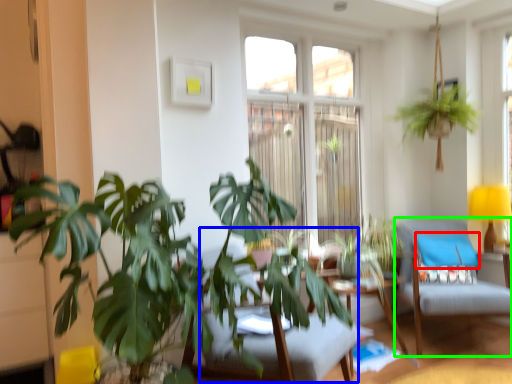
Question: Which object is positioned farthest from pillow (highlighted by a red box)? Select from swivel chair (highlighted by a blue box) and swivel chair (highlighted by a green box).

Choices:
 (A) swivel chair
 (B) swivel chair

Answer: (A)